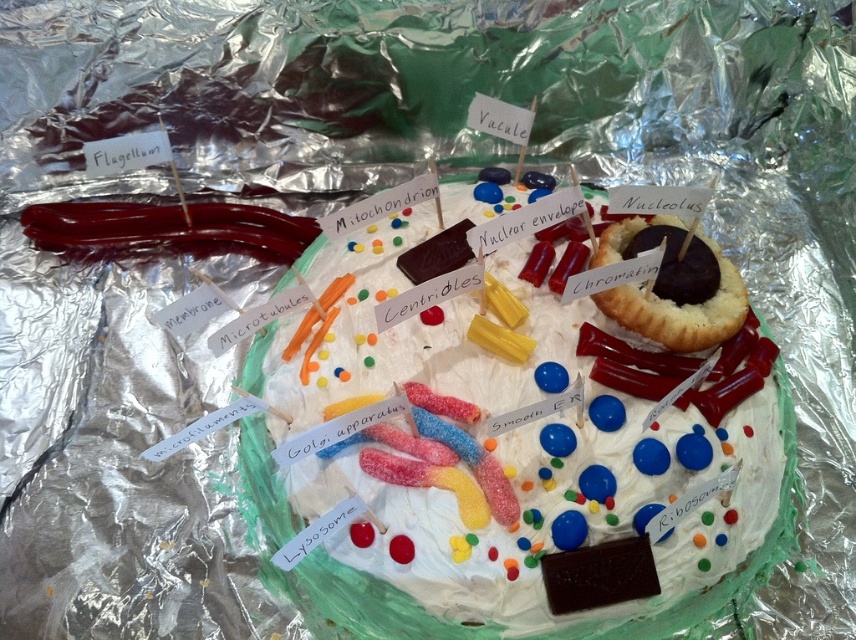
You are standing 5 feet away from the cell model. You want to reach the point at coordinates point (666,612) without moving your feet. Can you extend your arm to touch it?

The distance of point (666,612) from camera is 3.70 feet, so yes, you can extend your arm to touch it since it is within reach.

You are a student observing this cell model made of food items. You notice the smooth chocolate cake at center and the chocolate cake at upper right. Which part of the cell is taller?

The smooth chocolate cake at center is much taller than the chocolate cake at upper right. Therefore, the smooth chocolate cake at center represents the taller part of the cell in this model.